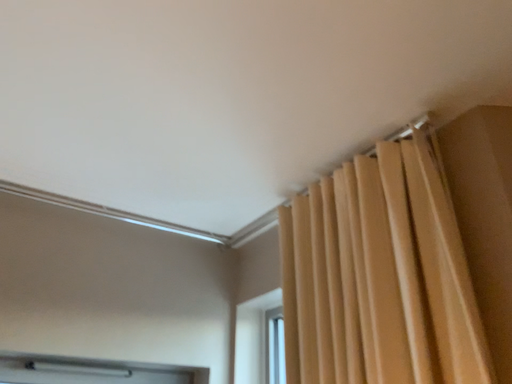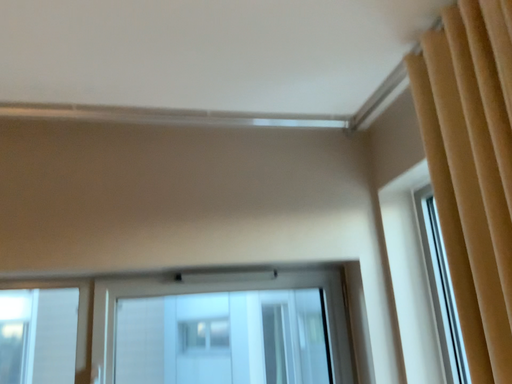
Question: Which way did the camera rotate in the video?

Choices:
 (A) rotated right
 (B) rotated left

Answer: (B)